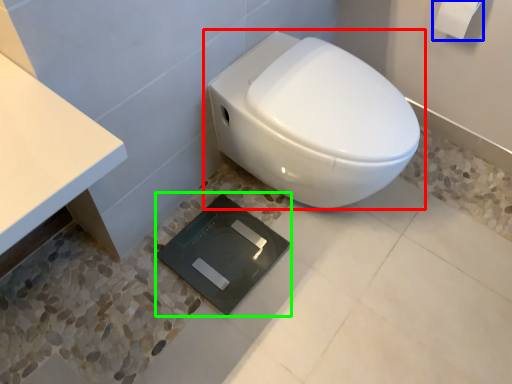
Question: Considering the real-world distances, which object is closest to toilet (highlighted by a red box)? toilet paper (highlighted by a blue box) or pad (highlighted by a green box).

Choices:
 (A) toilet paper
 (B) pad

Answer: (B)